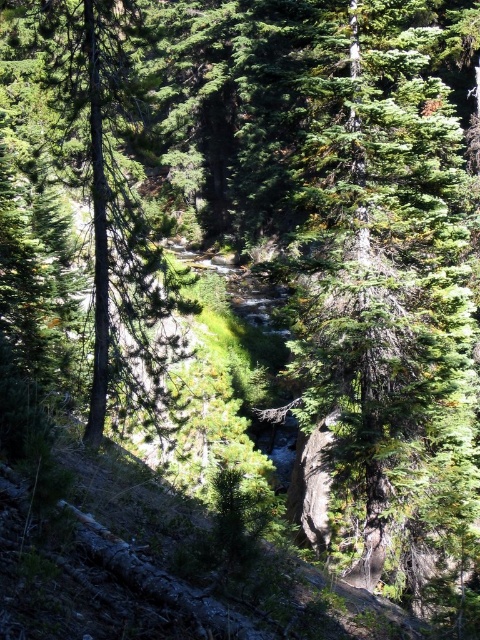
Does green textured tree at center have a smaller size compared to green rough bark tree at center?

Indeed, green textured tree at center has a smaller size compared to green rough bark tree at center.

Between point (324, 497) and point (4, 280), which one is positioned behind?

The point (324, 497) is behind.

Does point (340, 506) lie behind point (107, 115)?

Yes, it is behind point (107, 115).

At what (x,y) coordinates should I click in order to perform the action: click on green textured tree at center. Please return your answer as a coordinate pair (x, y). The width and height of the screenshot is (480, 640). Looking at the image, I should click on (384, 300).